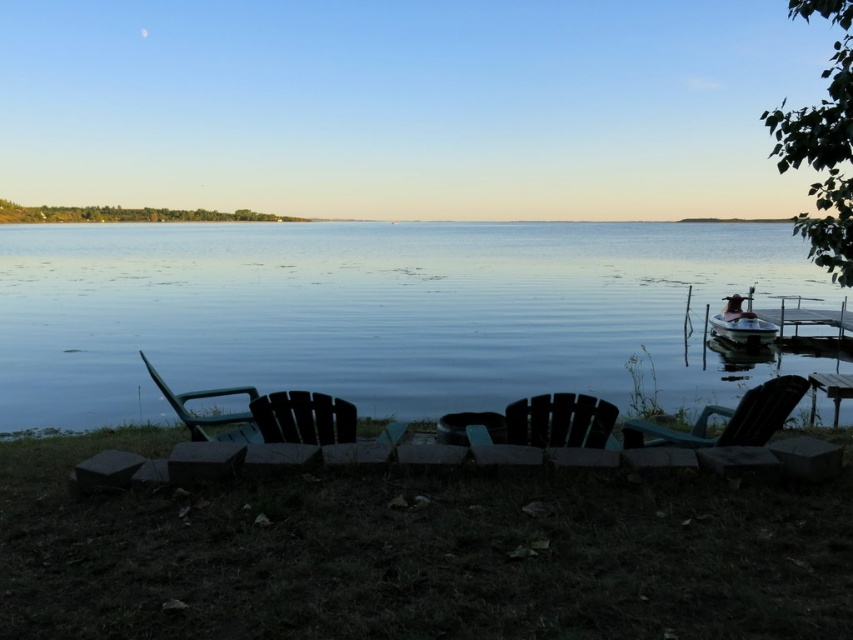
You are standing at the center of the grassy area in the lakeside scene. You want to move towards the teal plastic chair at right. What direction should you head in?

The teal plastic chair at right is located at coordinates point (728,419), so you should head towards the right and slightly forward to reach it.

You are standing at the edge of the lake and want to sit down on the black wood chair at center. However, there is a metallic silver boat at right in your way. Based on the scene description, can you walk around the boat to reach the chair?

The black wood chair at center is located below the metallic silver boat at right, which means the boat is positioned higher up. Since the boat is higher, you can walk around it to reach the chair located lower down.

You are standing on the grassy area near the stone wall and want to sit down. Which object, the teal plastic chair at right or the metallic silver boat at right, is easier to reach without moving past the stone wall?

The teal plastic chair at right is closer to the viewer than the metallic silver boat at right, so it is easier to reach without moving past the stone wall.